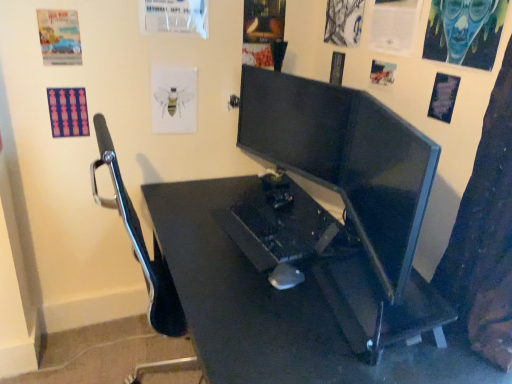
What do you see at coordinates (344, 22) in the screenshot? The image size is (512, 384). I see `charcoal sketch at upper right, which is the fifth poster page in left-to-right order` at bounding box center [344, 22].

At what (x,y) coordinates should I click in order to perform the action: click on white paper at upper right, the 3th poster page from the right. Please return your answer as a coordinate pair (x, y). Looking at the image, I should click on (394, 26).

What do you see at coordinates (68, 112) in the screenshot? This screenshot has height=384, width=512. I see `pink fabric poster at upper left, the 1th poster page when ordered from left to right` at bounding box center [68, 112].

Locate an element on the screen. The image size is (512, 384). matte paper poster at upper right, arranged as the 6th poster page when viewed from the left is located at coordinates (382, 73).

What do you see at coordinates (173, 99) in the screenshot? I see `white paper bee at upper center, which is the seventh poster page in right-to-left order` at bounding box center [173, 99].

I want to click on white paper bee at upper center, which is the seventh poster page in right-to-left order, so click(x=173, y=99).

This screenshot has width=512, height=384. What are the coordinates of `charcoal sketch at upper right, which is the fifth poster page in left-to-right order` in the screenshot? It's located at (344, 22).

Between white paper bee at upper center, which is the seventh poster page in right-to-left order, and matte black monitor at center, which is the second computer monitor from left to right, which one has larger size?

With larger size is matte black monitor at center, which is the second computer monitor from left to right.

What's the angular difference between white paper bee at upper center, which is the seventh poster page in right-to-left order, and matte black monitor at center, the 1th computer monitor in the front-to-back sequence,'s facing directions?

110 degrees separate the facing orientations of white paper bee at upper center, which is the seventh poster page in right-to-left order, and matte black monitor at center, the 1th computer monitor in the front-to-back sequence.

Could you measure the distance between white paper bee at upper center, which is the seventh poster page in right-to-left order, and matte black monitor at center, arranged as the first computer monitor when viewed from the right?

white paper bee at upper center, which is the seventh poster page in right-to-left order, and matte black monitor at center, arranged as the first computer monitor when viewed from the right, are 37.29 inches apart from each other.

From the image's perspective, would you say white paper bee at upper center, which is the seventh poster page in right-to-left order, is positioned over matte black monitor at center, arranged as the first computer monitor when viewed from the right?

Yes.

Between point (400, 49) and point (495, 5), which one is positioned behind?

The point (400, 49) is farther.

Considering the relative sizes of white paper at upper right, which appears as the seventh poster page when viewed from the left, and blue painted canvas at upper right, placed as the ninth poster page when sorted from left to right, in the image provided, is white paper at upper right, which appears as the seventh poster page when viewed from the left, bigger than blue painted canvas at upper right, placed as the ninth poster page when sorted from left to right,?

No.

Considering their positions, is white paper at upper right, which appears as the seventh poster page when viewed from the left, located in front of or behind blue painted canvas at upper right, which is the 1th poster page from right to left?

Visually, white paper at upper right, which appears as the seventh poster page when viewed from the left, is located behind blue painted canvas at upper right, which is the 1th poster page from right to left.

From the image's perspective, which one is positioned higher, white paper at upper right, which appears as the seventh poster page when viewed from the left, or blue painted canvas at upper right, placed as the ninth poster page when sorted from left to right?

white paper at upper right, which appears as the seventh poster page when viewed from the left, appears higher in the image.

Between pink fabric poster at upper left, the 1th poster page when ordered from left to right, and matte paper poster at upper left, the second poster page viewed from the left, which one has larger size?

Result: pink fabric poster at upper left, the 1th poster page when ordered from left to right.

Is matte paper poster at upper left, the second poster page viewed from the left, at the back of pink fabric poster at upper left, the 1th poster page when ordered from left to right?

No, matte paper poster at upper left, the second poster page viewed from the left, is not at the back of pink fabric poster at upper left, the 1th poster page when ordered from left to right.

From their relative heights in the image, would you say pink fabric poster at upper left, the 1th poster page when ordered from left to right, is taller or shorter than matte paper poster at upper left, which is counted as the 8th poster page, starting from the right?

Considering their sizes, pink fabric poster at upper left, the 1th poster page when ordered from left to right, has less height than matte paper poster at upper left, which is counted as the 8th poster page, starting from the right.

From the image's perspective, is pink fabric poster at upper left, the ninth poster page when ordered from right to left, above or below matte paper poster at upper left, the second poster page viewed from the left?

pink fabric poster at upper left, the ninth poster page when ordered from right to left, is below matte paper poster at upper left, the second poster page viewed from the left.

Considering the sizes of objects blue painted canvas at upper right, placed as the ninth poster page when sorted from left to right, and white paper bee at upper center, the 3th poster page from the left, in the image provided, who is shorter, blue painted canvas at upper right, placed as the ninth poster page when sorted from left to right, or white paper bee at upper center, the 3th poster page from the left,?

white paper bee at upper center, the 3th poster page from the left, is shorter.

Is blue painted canvas at upper right, placed as the ninth poster page when sorted from left to right, turned away from white paper bee at upper center, which is the seventh poster page in right-to-left order?

No, blue painted canvas at upper right, placed as the ninth poster page when sorted from left to right, is not facing away from white paper bee at upper center, which is the seventh poster page in right-to-left order.

From the image's perspective, does blue painted canvas at upper right, placed as the ninth poster page when sorted from left to right, appear lower than white paper bee at upper center, the 3th poster page from the left?

No.

Which point is more forward, [437,15] or [168,106]?

Positioned in front is point [437,15].

From the image's perspective, is matte paper poster at upper right, arranged as the 6th poster page when viewed from the left, below black plastic desk at center?

No.

From a real-world perspective, who is located lower, matte paper poster at upper right, arranged as the 6th poster page when viewed from the left, or black plastic desk at center?

From a 3D spatial view, black plastic desk at center is below.

Is matte paper poster at upper right, the fourth poster page when ordered from right to left, oriented towards black plastic desk at center?

No, matte paper poster at upper right, the fourth poster page when ordered from right to left, does not turn towards black plastic desk at center.

How distant is matte paper poster at upper right, the fourth poster page when ordered from right to left, from black plastic desk at center?

matte paper poster at upper right, the fourth poster page when ordered from right to left, is 85.08 centimeters away from black plastic desk at center.

Considering the relative sizes of black plastic desk at center and matte black monitor at center, placed as the second computer monitor when sorted from back to front, in the image provided, is black plastic desk at center thinner than matte black monitor at center, placed as the second computer monitor when sorted from back to front,?

In fact, black plastic desk at center might be wider than matte black monitor at center, placed as the second computer monitor when sorted from back to front.

Relative to matte black monitor at center, which is the second computer monitor from left to right, is black plastic desk at center in front or behind?

Clearly, black plastic desk at center is in front of matte black monitor at center, which is the second computer monitor from left to right.

From the image's perspective, relative to matte black monitor at center, which is the second computer monitor from left to right, is black plastic desk at center above or below?

From the image's perspective, black plastic desk at center appears below matte black monitor at center, which is the second computer monitor from left to right.

Considering the positions of objects black plastic desk at center and matte black monitor at center, which is the second computer monitor from left to right, in the image provided, who is more to the left, black plastic desk at center or matte black monitor at center, which is the second computer monitor from left to right,?

black plastic desk at center.

Does blue painted canvas at upper right, placed as the ninth poster page when sorted from left to right, come in front of matte black monitor at center, placed as the second computer monitor when sorted from back to front?

No, blue painted canvas at upper right, placed as the ninth poster page when sorted from left to right, is further to the viewer.

Locate an element on the screen. Image resolution: width=512 pixels, height=384 pixels. the 1st computer monitor counting from the left side of the blue painted canvas at upper right, placed as the ninth poster page when sorted from left to right is located at coordinates (383, 182).

Is blue painted canvas at upper right, which is the 1th poster page from right to left, positioned beyond the bounds of matte black monitor at center, placed as the second computer monitor when sorted from back to front?

A: blue painted canvas at upper right, which is the 1th poster page from right to left, is positioned outside matte black monitor at center, placed as the second computer monitor when sorted from back to front.

From the matte black monitor at center, arranged as the first computer monitor when viewed from the right, count 9th poster pages backward and point to it. Please provide its 2D coordinates.

[(173, 99)]

Image resolution: width=512 pixels, height=384 pixels. In order to click on the 1st poster page directly beneath the blue painted canvas at upper right, placed as the ninth poster page when sorted from left to right (from a real-world perspective) in this screenshot , I will do `click(394, 26)`.

From the image, which object appears to be farther from blue painted canvas at upper right, which is the 1th poster page from right to left, matte paper poster at upper left, the second poster page viewed from the left, or matte black monitor at center, which appears as the 1th computer monitor when viewed from the back?

matte paper poster at upper left, the second poster page viewed from the left.

Consider the image. When comparing their distances from white paper at upper center, the sixth poster page in the right-to-left sequence, does matte paper poster at upper right, the fourth poster page when ordered from right to left, or matte black monitor at center, which is counted as the 2th computer monitor, starting from the right, seem closer?

Among the two, matte black monitor at center, which is counted as the 2th computer monitor, starting from the right, is located nearer to white paper at upper center, the sixth poster page in the right-to-left sequence.

Based on their spatial positions, is white paper bee at upper center, which is the seventh poster page in right-to-left order, or matte paper poster at upper right, arranged as the 6th poster page when viewed from the left, further from black plastic mouse at center?

The object further to black plastic mouse at center is white paper bee at upper center, which is the seventh poster page in right-to-left order.

Based on their spatial positions, is matte black monitor at center, which is the second computer monitor from left to right, or black plastic desk at center further from white paper at upper center, acting as the 4th poster page starting from the left?

black plastic desk at center.

When comparing their distances from matte black monitor at center, placed as the second computer monitor when sorted from back to front, does white paper at upper right, which appears as the seventh poster page when viewed from the left, or pink fabric poster at upper left, the 1th poster page when ordered from left to right, seem closer?

Among the two, white paper at upper right, which appears as the seventh poster page when viewed from the left, is located nearer to matte black monitor at center, placed as the second computer monitor when sorted from back to front.

Based on their spatial positions, is blue paper poster at upper right, which appears as the second poster page when viewed from the right, or black plastic mouse at center closer to black plastic desk at center?

Among the two, black plastic mouse at center is located nearer to black plastic desk at center.

From the image, which object appears to be farther from white paper at upper center, acting as the 4th poster page starting from the left, white paper at upper right, the 3th poster page from the right, or blue paper poster at upper right, which appears as the second poster page when viewed from the right?

The object further to white paper at upper center, acting as the 4th poster page starting from the left, is blue paper poster at upper right, which appears as the second poster page when viewed from the right.

Estimate the real-world distances between objects in this image. Which object is further from black plastic mouse at center, white paper bee at upper center, the 3th poster page from the left, or matte black monitor at center, the 1th computer monitor in the front-to-back sequence?

white paper bee at upper center, the 3th poster page from the left, lies further to black plastic mouse at center than the other object.

You are a GUI agent. You are given a task and a screenshot of the screen. Output one action in this format:
    pyautogui.click(x=<x>, y=<y>)
    Task: Click on the poster page between matte paper poster at upper left, which is counted as the 8th poster page, starting from the right, and white paper at upper center, the sixth poster page in the right-to-left sequence, from left to right
    This screenshot has height=384, width=512.
    Given the screenshot: What is the action you would take?
    pyautogui.click(x=173, y=99)

Where is `mouse between pink fabric poster at upper left, the 1th poster page when ordered from left to right, and charcoal sketch at upper right, the 5th poster page from the right, from left to right`? The height and width of the screenshot is (384, 512). mouse between pink fabric poster at upper left, the 1th poster page when ordered from left to right, and charcoal sketch at upper right, the 5th poster page from the right, from left to right is located at coordinates (285, 276).

At what (x,y) coordinates should I click in order to perform the action: click on computer monitor situated between pink fabric poster at upper left, the 1th poster page when ordered from left to right, and matte black monitor at center, the 1th computer monitor in the front-to-back sequence, from left to right. Please return your answer as a coordinate pair (x, y). Looking at the image, I should click on (295, 123).

Find the location of a particular element. This screenshot has height=384, width=512. desk situated between matte paper poster at upper left, which is counted as the 8th poster page, starting from the right, and blue painted canvas at upper right, placed as the ninth poster page when sorted from left to right, from left to right is located at coordinates (280, 291).